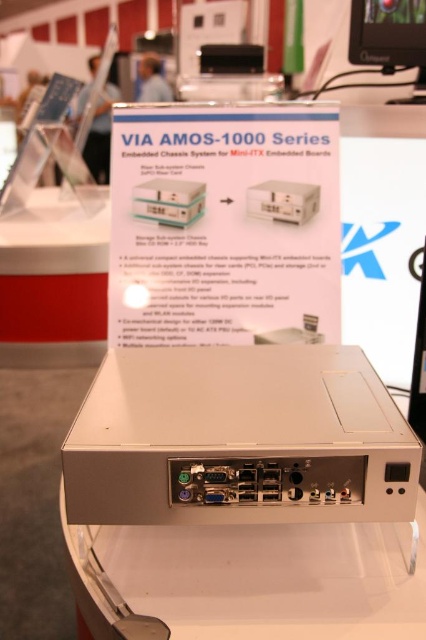
Consider the image. You are standing at the entrance of the exhibition hall and want to approach the white plastic table at center. Based on the coordinates provided, can you estimate the direction you should walk to reach it?

The white plastic table at center is located at coordinates point [249,580]. Since the coordinate system typically places [0,0] at the bottom left corner and [425,639] at the top right corner, the table is positioned towards the right side and slightly above the center of the image. To reach it from the entrance, you should walk towards the right side of the hall.

What is the object located at coordinates point (x=249, y=580) in the image?

The point (x=249, y=580) marks the white plastic table at center.